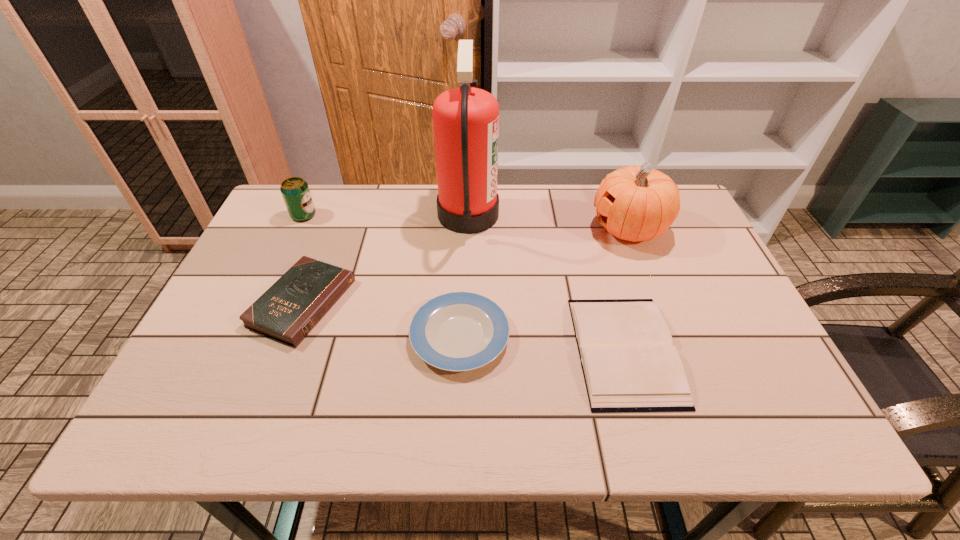
Locate an element on the screen. object that is the third closest to the fire extinguisher is located at coordinates (629, 364).

Choose which object is the nearest neighbor to the hardback book. Please provide its 2D coordinates. Your answer should be formatted as a tuple, i.e. [(x, y)], where the tuple contains the x and y coordinates of a point satisfying the conditions above.

[(458, 331)]

I want to click on free space in the image that satisfies the following two spatial constraints: 1. at the nozzle of the hardback book; 2. on the left side of the tallest object, so click(464, 350).

Find the location of `free location that satisfies the following two spatial constraints: 1. on the front side of the Bible; 2. on the left side of the hardback book`. free location that satisfies the following two spatial constraints: 1. on the front side of the Bible; 2. on the left side of the hardback book is located at coordinates (284, 350).

Where is `free space that satisfies the following two spatial constraints: 1. at the nozzle of the hardback book; 2. on the right side of the tallest object`? The height and width of the screenshot is (540, 960). free space that satisfies the following two spatial constraints: 1. at the nozzle of the hardback book; 2. on the right side of the tallest object is located at coordinates (464, 350).